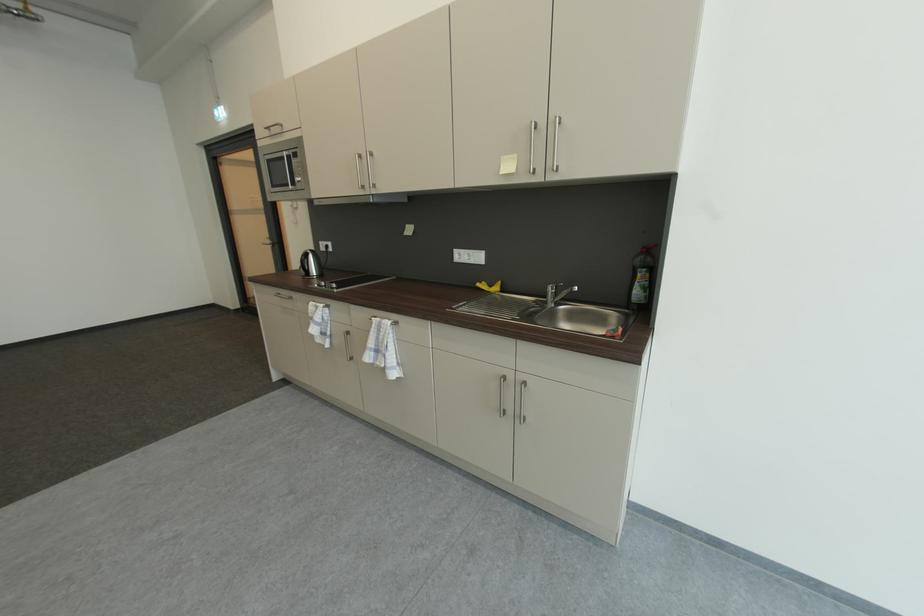
What do you see at coordinates (502, 395) in the screenshot? I see `a silver door handle` at bounding box center [502, 395].